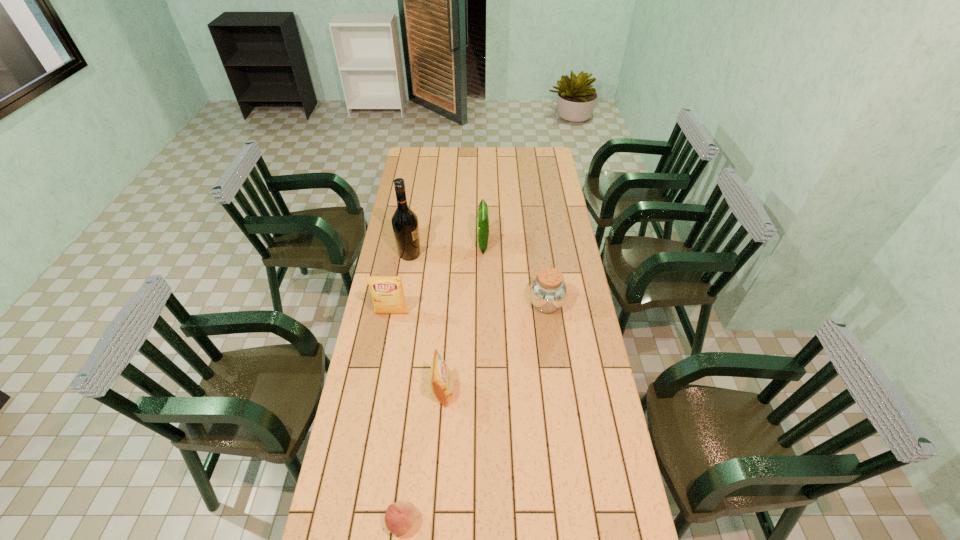
Find the location of a particular element. The width and height of the screenshot is (960, 540). free spot that satisfies the following two spatial constraints: 1. on the label of the tallest object; 2. on the front of the leftmost crisp (potato chip) with the logo is located at coordinates (400, 314).

What are the coordinates of `vacant space that satisfies the following two spatial constraints: 1. on the label of the wine bottle; 2. on the right side of the shortest object` in the screenshot? It's located at (367, 522).

At what (x,y) coordinates should I click in order to perform the action: click on free spot that satisfies the following two spatial constraints: 1. on the label of the tallest object; 2. on the back side of the third object from left to right. Please return your answer as a coordinate pair (x, y). This screenshot has height=540, width=960. Looking at the image, I should click on (367, 522).

Image resolution: width=960 pixels, height=540 pixels. In order to click on vacant region that satisfies the following two spatial constraints: 1. on the back side of the peach; 2. on the label of the tallest object in this screenshot , I will do click(432, 254).